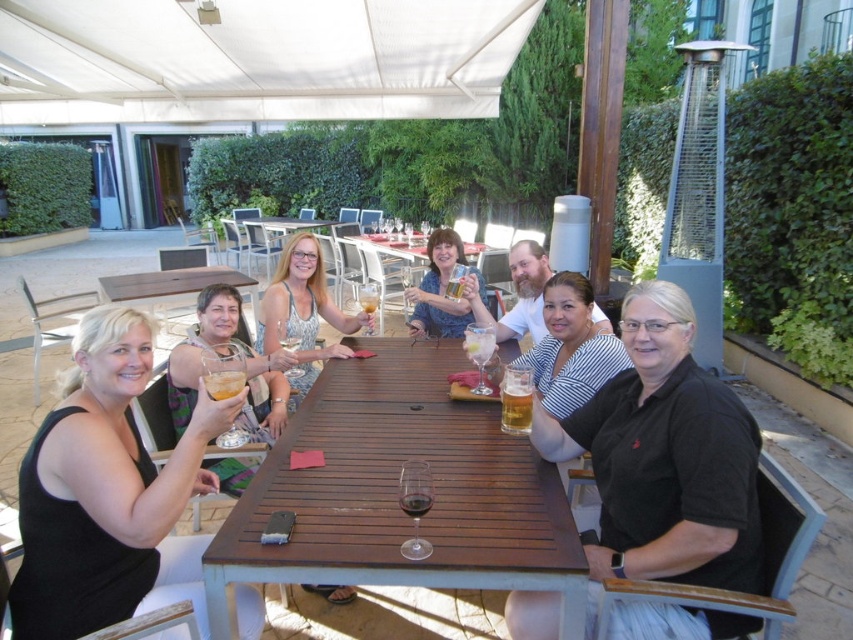
What do you see at coordinates (665, 456) in the screenshot? I see `black matte shirt at center` at bounding box center [665, 456].

Does black matte shirt at center have a lesser height compared to matte plastic cup at center?

Incorrect, black matte shirt at center's height does not fall short of matte plastic cup at center's.

Is point (744, 472) less distant than point (434, 284)?

That is True.

You are a GUI agent. You are given a task and a screenshot of the screen. Output one action in this format:
    pyautogui.click(x=<x>, y=<y>)
    Task: Click on the black matte shirt at center
    Image resolution: width=853 pixels, height=640 pixels.
    Given the screenshot: What is the action you would take?
    tap(665, 456)

Is black matte tank top at left below matte plastic cup at center?

Yes, black matte tank top at left is below matte plastic cup at center.

Who is more forward, (166,586) or (419,284)?

Point (166,586) is more forward.

Is point (125, 493) positioned after point (432, 296)?

No, (125, 493) is closer to viewer.

Image resolution: width=853 pixels, height=640 pixels. What are the coordinates of `black matte tank top at left` in the screenshot? It's located at (108, 493).

Does black matte shirt at center appear on the left side of matte black dress at center?

Incorrect, black matte shirt at center is not on the left side of matte black dress at center.

Is point (630, 291) more distant than point (187, 419)?

No, it is not.

The height and width of the screenshot is (640, 853). Describe the element at coordinates (665, 456) in the screenshot. I see `black matte shirt at center` at that location.

Where is `black matte shirt at center`? This screenshot has height=640, width=853. black matte shirt at center is located at coordinates (665, 456).